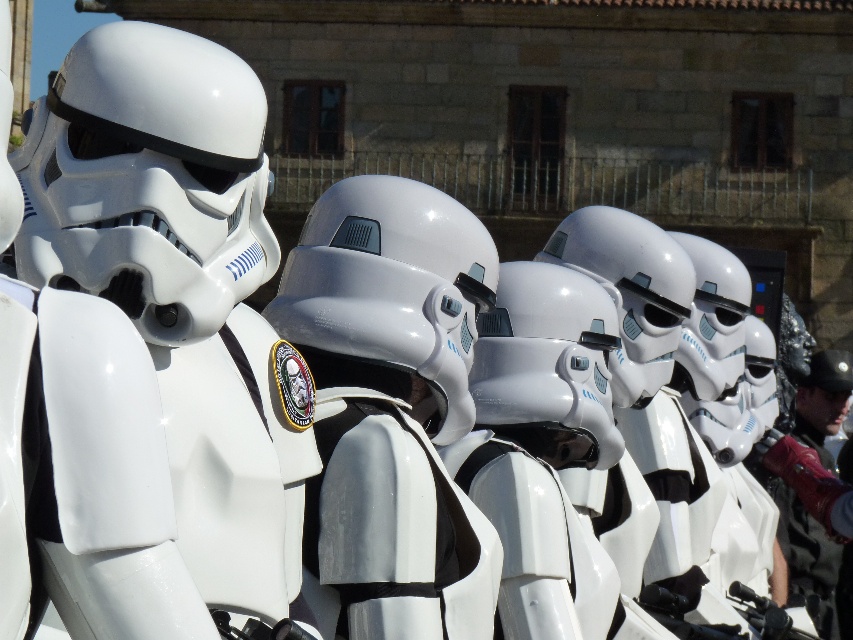
Question: Is matte white helmet at left below glossy white helmet at center?

Choices:
 (A) yes
 (B) no

Answer: (B)

Question: Where is matte white helmet at left located in relation to glossy white helmet at center in the image?

Choices:
 (A) above
 (B) below

Answer: (A)

Question: Which point appears farthest from the camera in this image?

Choices:
 (A) tap(27, 177)
 (B) tap(389, 428)

Answer: (B)

Question: Does matte white helmet at left appear on the left side of glossy white helmet at center?

Choices:
 (A) no
 (B) yes

Answer: (B)

Question: Which object appears farthest from the camera in this image?

Choices:
 (A) glossy white helmet at center
 (B) matte white helmet at left

Answer: (A)